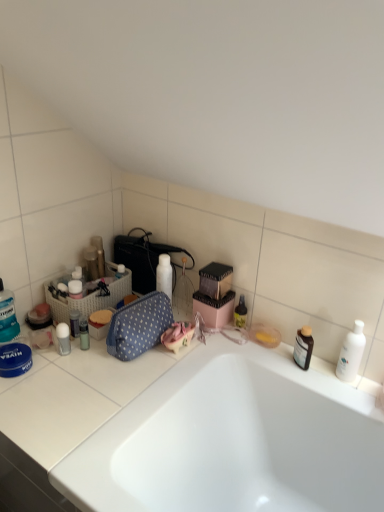
Where is `unoccupied region to the right of brown glass bottle at right, positioned as the 9th toiletry in left-to-right order`? This screenshot has width=384, height=512. unoccupied region to the right of brown glass bottle at right, positioned as the 9th toiletry in left-to-right order is located at coordinates (339, 381).